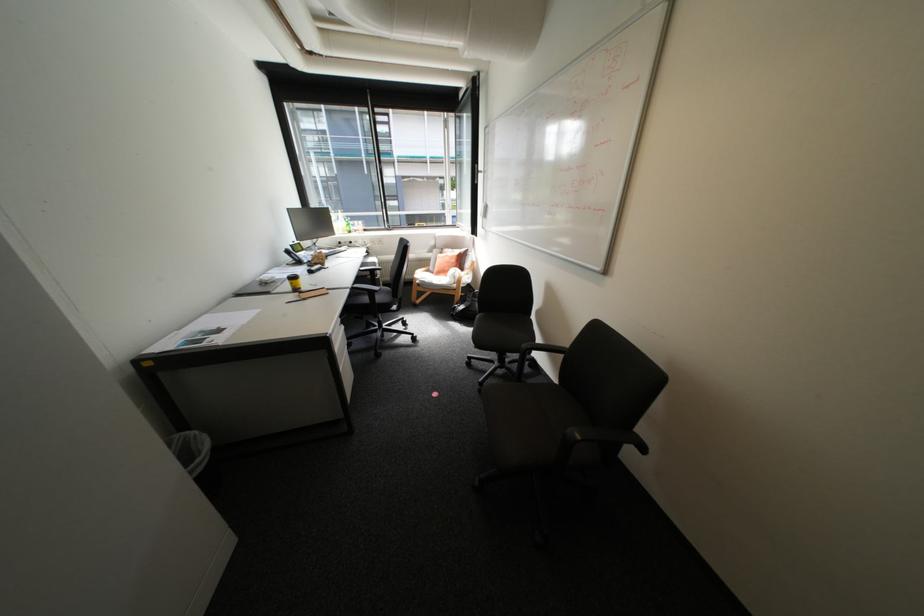
Where would you grasp the wooden chair armrest? Please return your answer as a coordinate pair (x, y).

(502, 331)